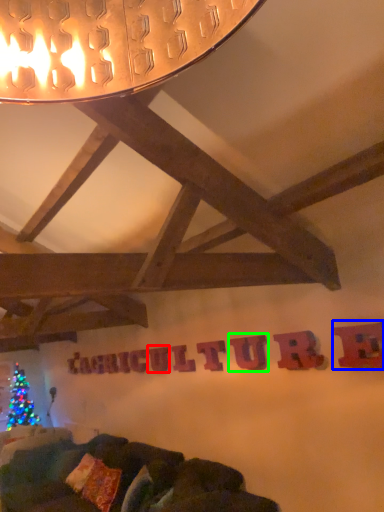
Question: Which object is the farthest from letter (highlighted by a red box)? Choose among these: letter (highlighted by a blue box) or letter (highlighted by a green box).

Choices:
 (A) letter
 (B) letter

Answer: (A)